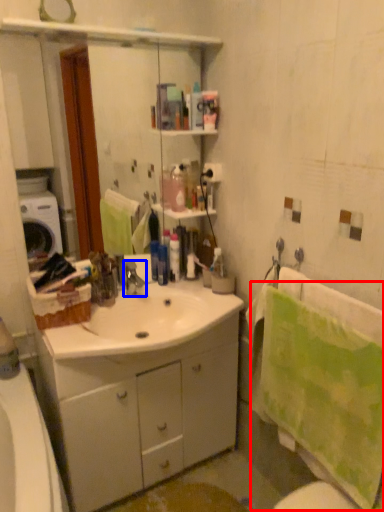
Question: Which object appears farthest to the camera in this image, bath towel (highlighted by a red box) or tap (highlighted by a blue box)?

Choices:
 (A) bath towel
 (B) tap

Answer: (B)